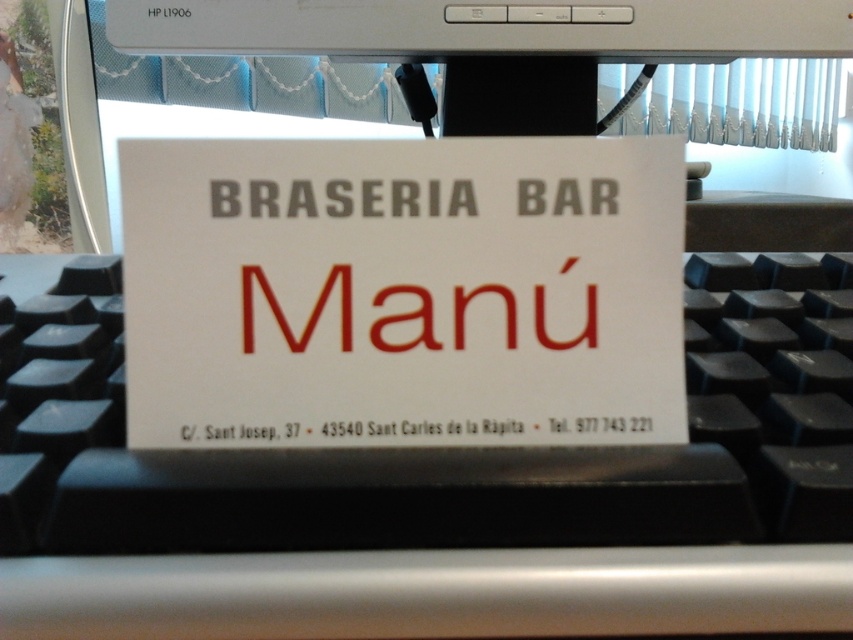
You are trying to navigate from the point at coordinates point(548, 326) to the point at coordinates point(834, 241). Which direction should you move in relation to the business card?

You should move towards the upper right direction since point(548, 326) is in front of point(834, 241), indicating that point(834, 241) is located behind and to the upper right relative to point(548, 326).

You are a graphic designer who needs to place a new logo exactly at the center of the white paper sign at center. According to the coordinates provided, where should you position the logo?

The logo should be placed at the coordinates point (x=402, y=291), which is the center of the white paper sign at center as specified in the description.